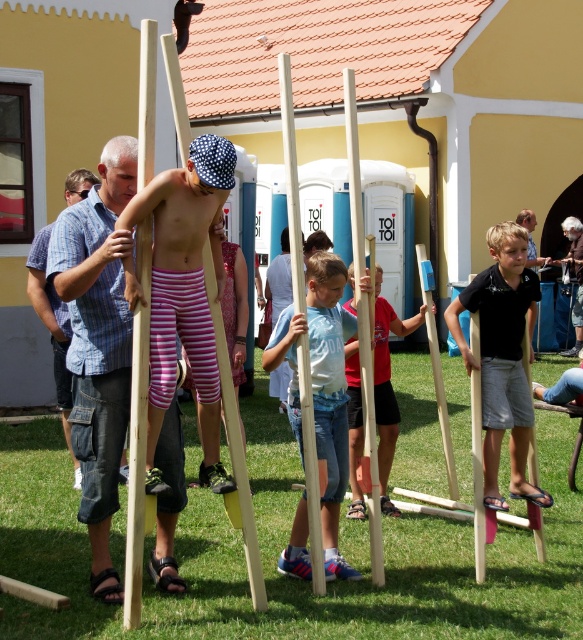
Which of these two, pink striped shorts at center or wooden pole at center, stands shorter?

wooden pole at center is shorter.

Does point (166, 346) come farther from viewer compared to point (289, 401)?

That is False.

Locate an element on the screen. Image resolution: width=583 pixels, height=640 pixels. pink striped shorts at center is located at coordinates (185, 289).

Between blue plaid shirt at center and smooth blue shorts at center, which one is positioned lower?

smooth blue shorts at center

Who is shorter, blue plaid shirt at center or smooth blue shorts at center?

smooth blue shorts at center

This screenshot has width=583, height=640. In order to click on blue plaid shirt at center in this screenshot , I will do `click(99, 342)`.

How much distance is there between pink striped shorts at center and smooth blue shorts at center?

They are 5.73 feet apart.

Is pink striped shorts at center taller than smooth blue shorts at center?

Indeed, pink striped shorts at center has a greater height compared to smooth blue shorts at center.

Is point (152, 349) farther from viewer compared to point (356, 449)?

No.

Where is `pink striped shorts at center`? The height and width of the screenshot is (640, 583). pink striped shorts at center is located at coordinates (185, 289).